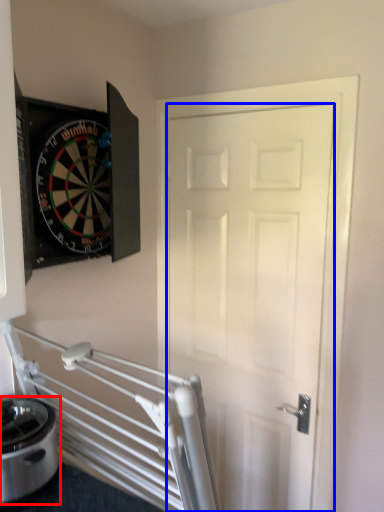
Question: Which point is closer to the camera, appliance (highlighted by a red box) or door (highlighted by a blue box)?

Choices:
 (A) appliance
 (B) door

Answer: (A)